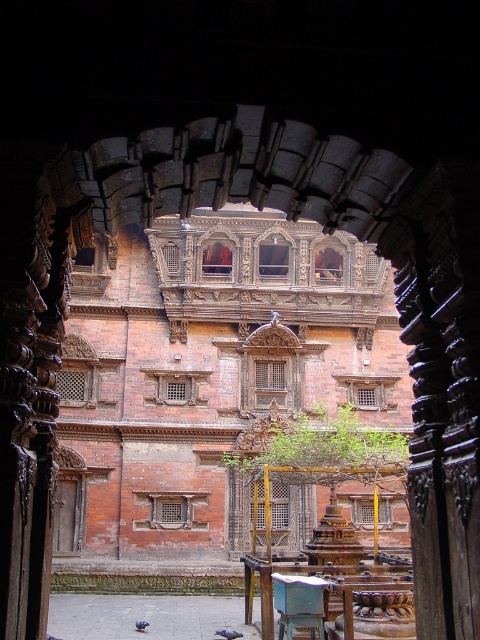
Question: Considering the relative positions of wooden chair at center and gray feathered pigeon at center in the image provided, where is wooden chair at center located with respect to gray feathered pigeon at center?

Choices:
 (A) right
 (B) left

Answer: (A)

Question: Which of the following is the farthest from the observer?

Choices:
 (A) wooden chair at center
 (B) gray feathered pigeon at center
 (C) blue feathered pigeon at center

Answer: (C)

Question: Based on their relative distances, which object is farther from the wooden chair at center?

Choices:
 (A) gray feathered pigeon at center
 (B) blue feathered pigeon at center
 (C) brown brick palace at center

Answer: (C)

Question: Does brown brick palace at center appear under wooden chair at center?

Choices:
 (A) yes
 (B) no

Answer: (B)

Question: Is wooden chair at center thinner than gray feathered pigeon at center?

Choices:
 (A) no
 (B) yes

Answer: (B)

Question: Which point appears farthest from the camera in this image?

Choices:
 (A) (139, 628)
 (B) (275, 483)
 (C) (320, 604)
 (D) (228, 632)

Answer: (B)